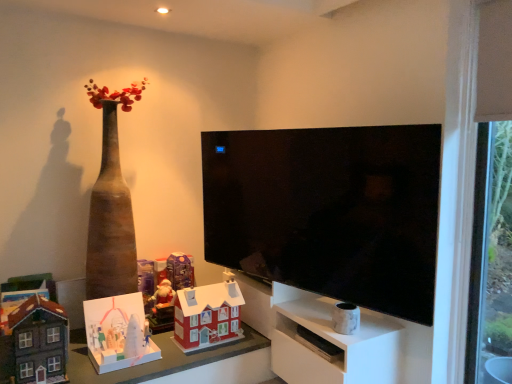
Find the location of a particular element. vacant space that is in between white cardboard house at lower left, which is the second toy in left-to-right order, and matte gray toy house at lower left, the 1th toy in the left-to-right sequence is located at coordinates (83, 364).